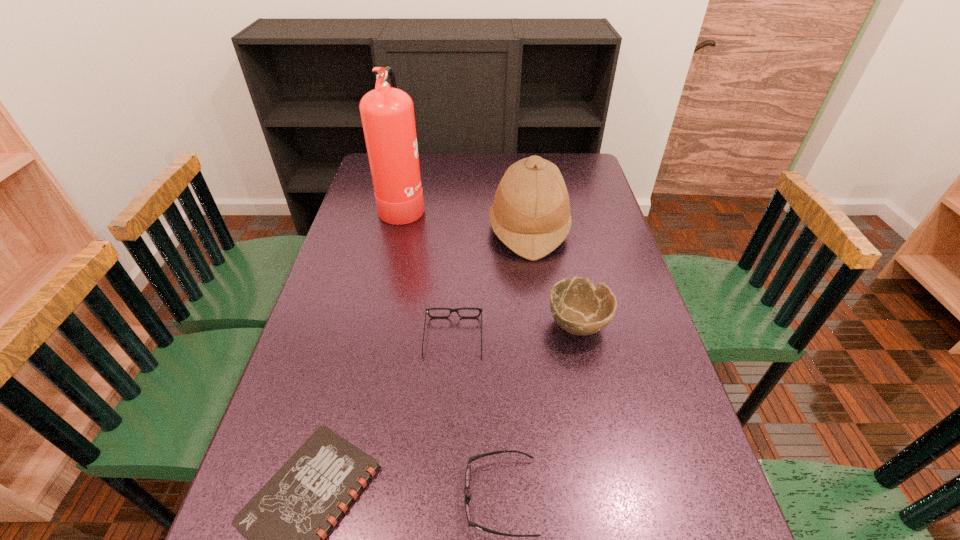
Locate an element on the screen. This screenshot has width=960, height=540. blank space located on the front-facing side of the spectacles is located at coordinates (458, 257).

Where is `free space located 0.160m on the front-facing side of the spectacles`? free space located 0.160m on the front-facing side of the spectacles is located at coordinates pos(457,275).

Where is `object that is positioned at the left edge`? The image size is (960, 540). object that is positioned at the left edge is located at coordinates (387, 113).

Image resolution: width=960 pixels, height=540 pixels. In order to click on hat present at the right edge in this screenshot , I will do `click(530, 214)`.

Locate an element on the screen. This screenshot has height=540, width=960. bowl located in the right edge section of the desktop is located at coordinates (578, 307).

Identify the location of vacant space at the far edge of the desktop. pyautogui.click(x=488, y=174).

Identify the location of vacant space at the left edge of the desktop. (300, 383).

In the image, there is a desktop. At what (x,y) coordinates should I click in order to perform the action: click on vacant area at the right edge. Please return your answer as a coordinate pair (x, y). This screenshot has height=540, width=960. Looking at the image, I should click on (614, 263).

This screenshot has width=960, height=540. In the image, there is a desktop. What are the coordinates of `vacant space at the far right corner` in the screenshot? It's located at (565, 176).

The height and width of the screenshot is (540, 960). In order to click on vacant area between the hat and the tallest object in this screenshot , I will do [x=466, y=217].